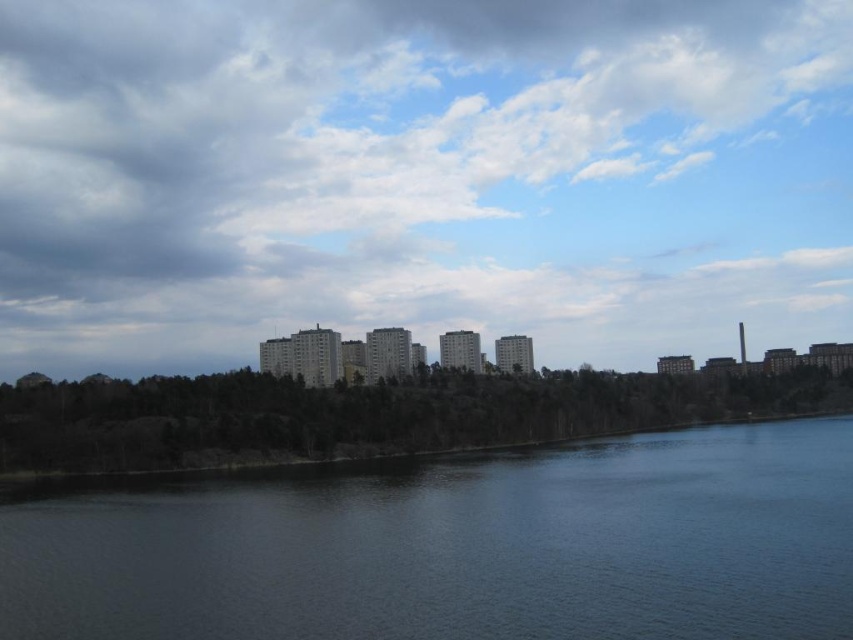
You are standing at the point labeled point (462,547) in the image. Based on the scene description, what type of surface are you currently standing on?

The point (462,547) is on dark blue water at lower center, so you are standing on water.

You are standing on a bridge overlooking the dark blue water at lower center and the green matte trees at lower center. Which object is closer to your feet?

The dark blue water at lower center is closer to your feet because it is positioned below the green matte trees at lower center.